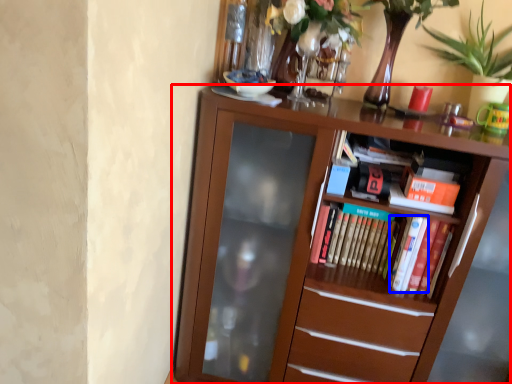
Question: Which point is closer to the camera, bookcase (highlighted by a red box) or paperback book (highlighted by a blue box)?

Choices:
 (A) bookcase
 (B) paperback book

Answer: (A)